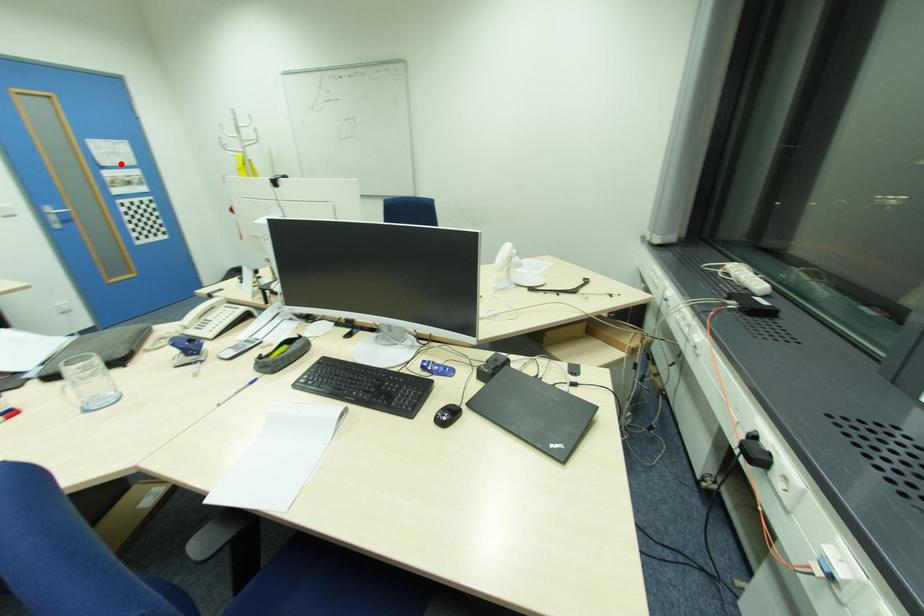
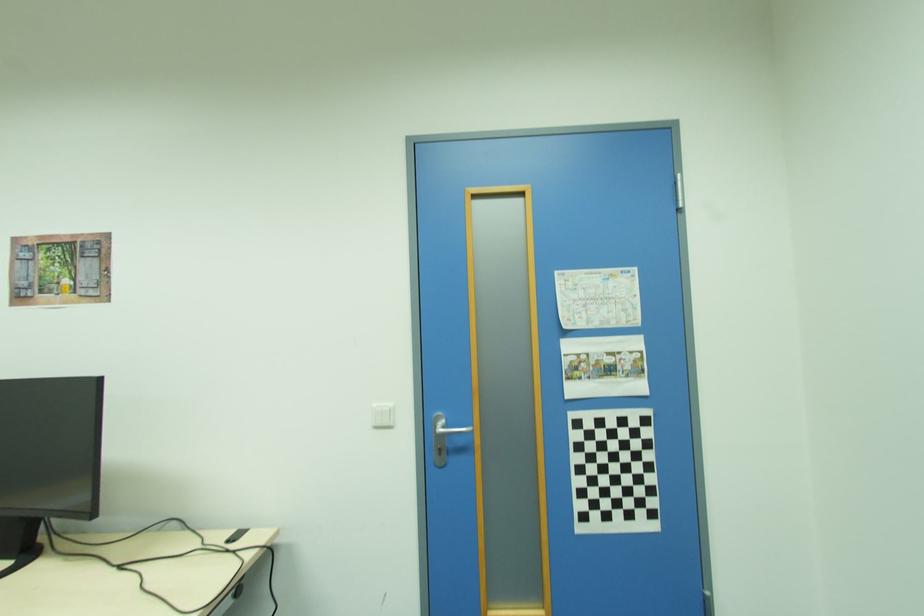
Find the pixel in the second image that matches the highlighted location in the first image.

(599, 325)